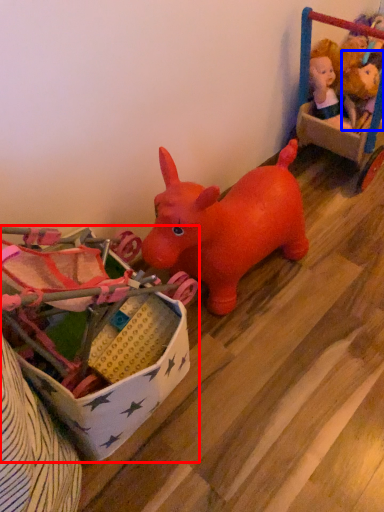
Question: Which object appears closest to the camera in this image, toy (highlighted by a red box) or toy (highlighted by a blue box)?

Choices:
 (A) toy
 (B) toy

Answer: (A)